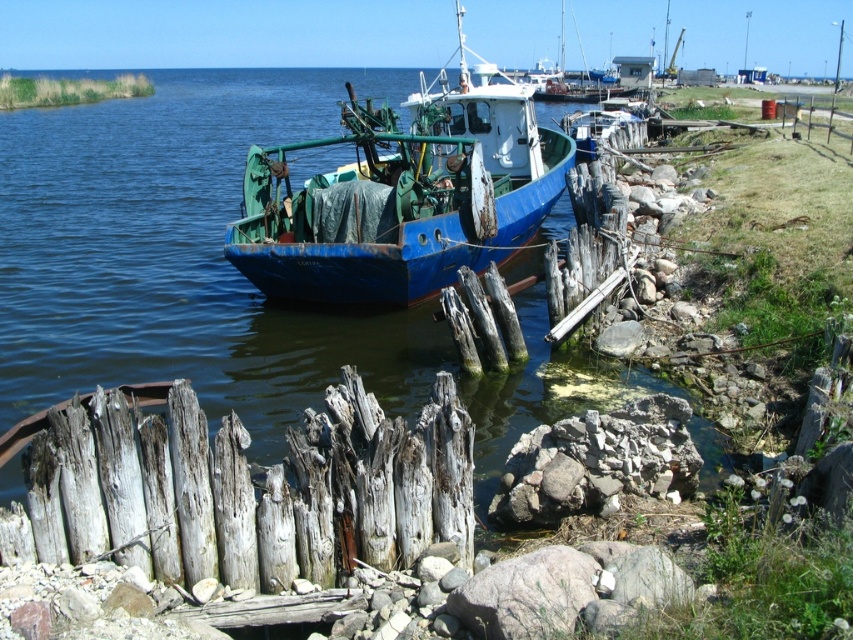
Is the position of weathered wood fence at lower left more distant than that of blue matte boat at center?

That is False.

Is weathered wood fence at lower left positioned in front of blue matte boat at center?

Yes, it is.

I want to click on weathered wood fence at lower left, so click(x=244, y=490).